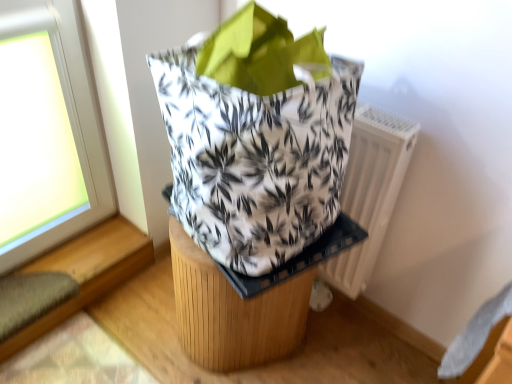
Question: Is white plastic radiator at right taller or shorter than wooden stool at center?

Choices:
 (A) short
 (B) tall

Answer: (B)

Question: Visually, is white plastic radiator at right positioned to the left or to the right of wooden stool at center?

Choices:
 (A) right
 (B) left

Answer: (A)

Question: Which is farther from the white printed fabric grocery bag at center?

Choices:
 (A) wooden stool at center
 (B) white plastic radiator at right

Answer: (B)

Question: Based on their relative distances, which object is nearer to the white printed fabric grocery bag at center?

Choices:
 (A) white plastic radiator at right
 (B) wooden stool at center

Answer: (B)